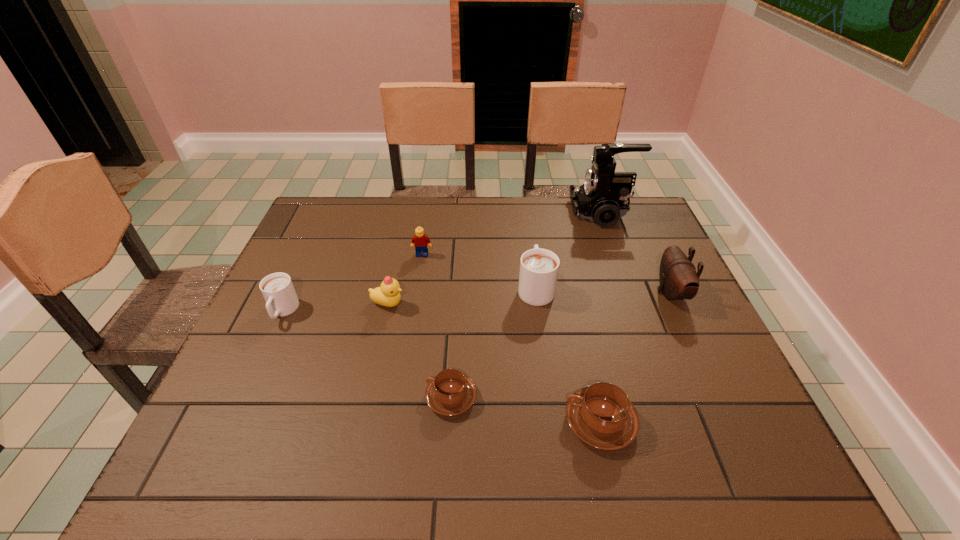
At what (x,y) coordinates should I click in order to perform the action: click on blank space located 0.190m on the side of the second cappuccino from left to right with the handle. Please return your answer as a coordinate pair (x, y). The image size is (960, 540). Looking at the image, I should click on 337,397.

The image size is (960, 540). I want to click on free region located 0.110m on the side of the second cappuccino from left to right with the handle, so click(x=374, y=397).

Where is `object at the far edge`? The width and height of the screenshot is (960, 540). object at the far edge is located at coordinates (603, 197).

Identify the location of object present at the near edge. The height and width of the screenshot is (540, 960). (601, 415).

What are the coordinates of `object located at the left edge` in the screenshot? It's located at (278, 291).

I want to click on camcorder at the right edge, so tap(603, 197).

This screenshot has width=960, height=540. Find the location of `pouch located in the right edge section of the desktop`. pouch located in the right edge section of the desktop is located at coordinates (678, 278).

Identify the location of object present at the far right corner. Image resolution: width=960 pixels, height=540 pixels. (603, 197).

The height and width of the screenshot is (540, 960). In the image, there is a desktop. Identify the location of vacant space at the far edge. (558, 201).

Where is `free space at the near edge of the desktop`? The height and width of the screenshot is (540, 960). free space at the near edge of the desktop is located at coordinates (400, 458).